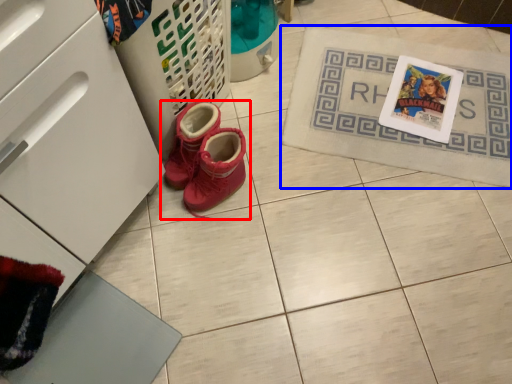
Question: Which point is closer to the camera, footwear (highlighted by a red box) or bath mat (highlighted by a blue box)?

Choices:
 (A) footwear
 (B) bath mat

Answer: (A)